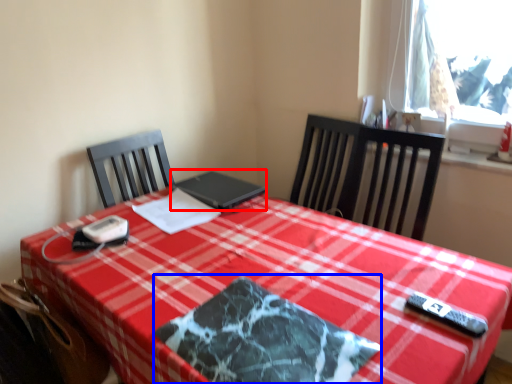
Question: Which object is further to the camera taking this photo, laptop (highlighted by a red box) or place mat (highlighted by a blue box)?

Choices:
 (A) laptop
 (B) place mat

Answer: (A)